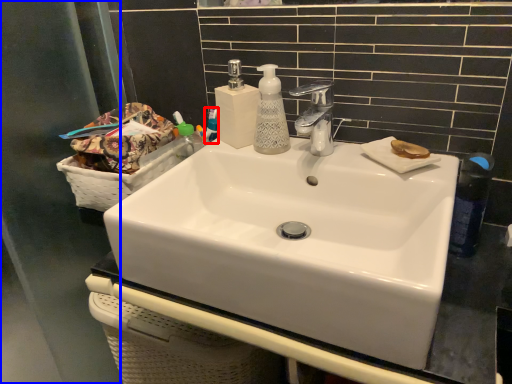
Question: Which of the following is the closest to the observer, mouthwash (highlighted by a red box) or screen door (highlighted by a blue box)?

Choices:
 (A) mouthwash
 (B) screen door

Answer: (B)